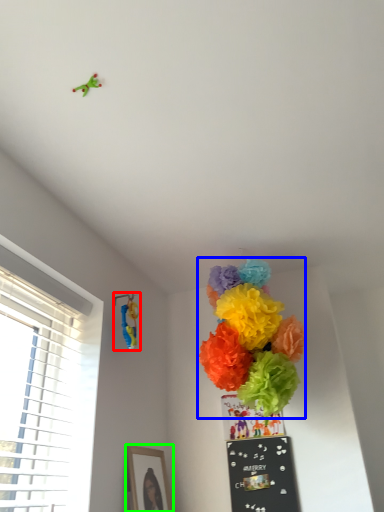
Question: Based on their relative distances, which object is nearer to toy (highlighted by a red box)? Choose from flower (highlighted by a blue box) and picture frame (highlighted by a green box).

Choices:
 (A) flower
 (B) picture frame

Answer: (A)